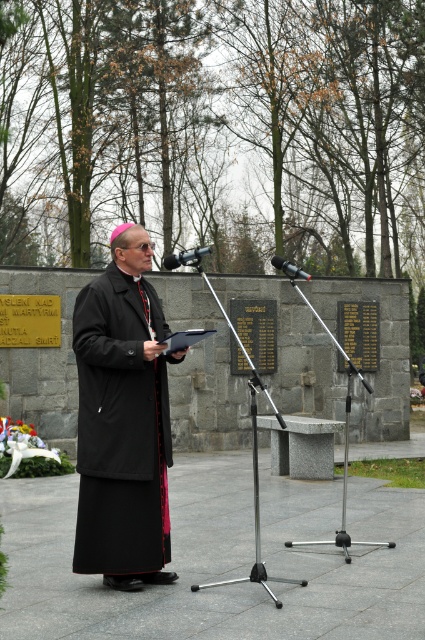
Question: Among these objects, which one is nearest to the camera?

Choices:
 (A) black metallic microphone at center
 (B) metallic silver microphone at center
 (C) black woolen robe at center

Answer: (B)

Question: Is metallic silver microphone at center bigger than black metallic microphone at center?

Choices:
 (A) no
 (B) yes

Answer: (B)

Question: Can you confirm if metallic silver microphone at center is bigger than black metallic microphone at center?

Choices:
 (A) no
 (B) yes

Answer: (B)

Question: Which is nearer to the black woolen robe at center?

Choices:
 (A) black metallic microphone at center
 (B) metallic silver microphone at center

Answer: (B)

Question: Which object appears closest to the camera in this image?

Choices:
 (A) black woolen robe at center
 (B) black metallic microphone at center
 (C) metallic silver microphone at center

Answer: (C)

Question: Is metallic silver microphone at center to the right of black metallic microphone at center from the viewer's perspective?

Choices:
 (A) yes
 (B) no

Answer: (B)